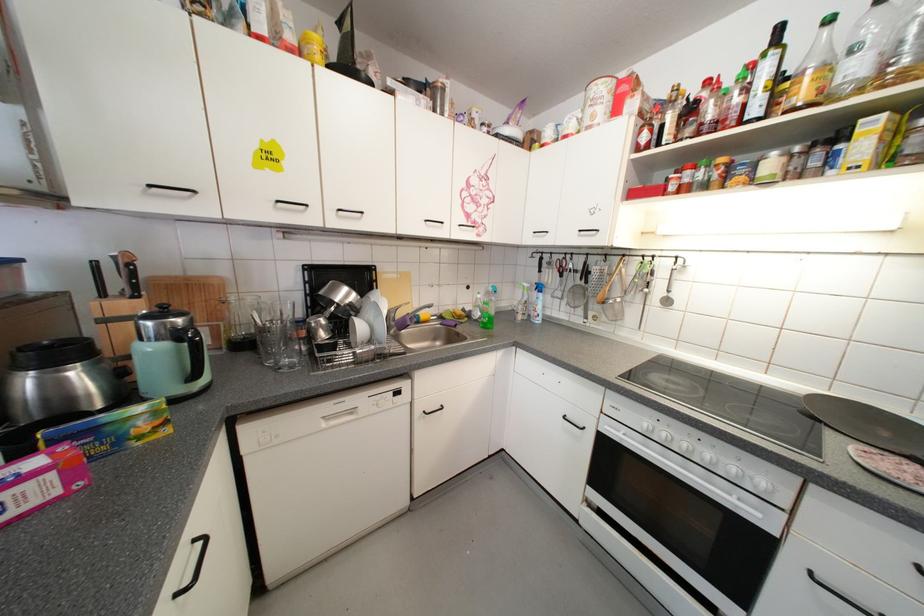
What do you see at coordinates (191, 351) in the screenshot?
I see `the teal kettle handle` at bounding box center [191, 351].